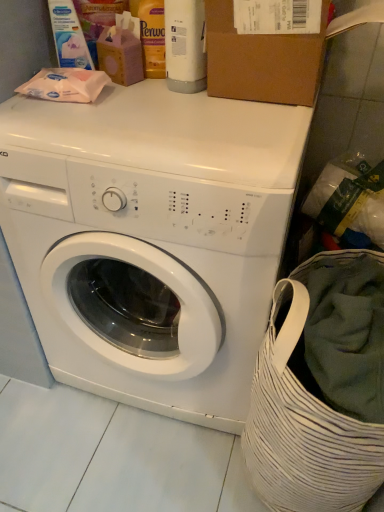
The height and width of the screenshot is (512, 384). In order to click on free space to the left of brown cardboard box at upper center in this screenshot , I will do `click(155, 111)`.